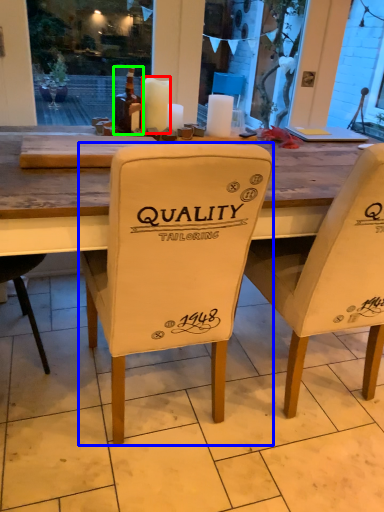
Question: Which object is positioned farthest from candle (highlighted by a red box)? Select from chair (highlighted by a blue box) and bottle (highlighted by a green box).

Choices:
 (A) chair
 (B) bottle

Answer: (A)